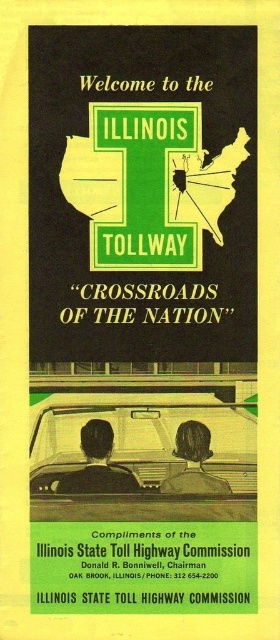
Looking at this image, does green matte sign at upper center have a smaller size compared to matte black car at center?

No, green matte sign at upper center is not smaller than matte black car at center.

Which is more to the left, green matte sign at upper center or matte black car at center?

green matte sign at upper center is more to the left.

The width and height of the screenshot is (280, 640). I want to click on green matte sign at upper center, so click(143, 193).

Identify the location of green matte sign at upper center. (143, 193).